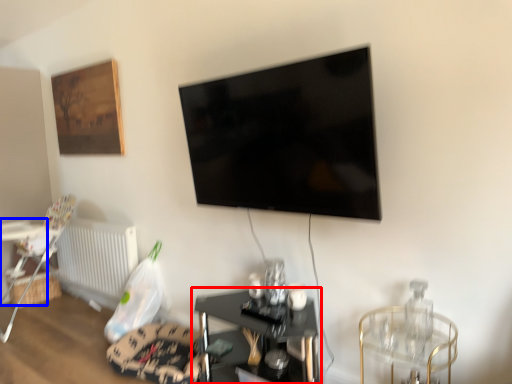
Question: Which object appears farthest to the camera in this image, table (highlighted by a red box) or table (highlighted by a blue box)?

Choices:
 (A) table
 (B) table

Answer: (B)